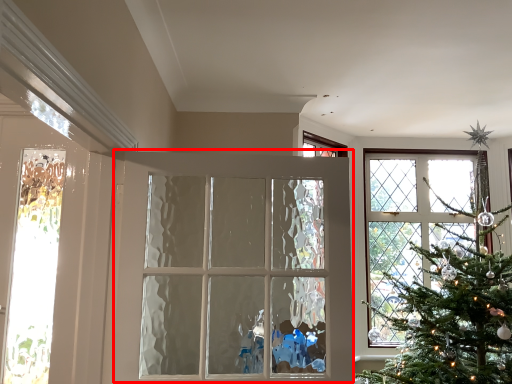
Question: From the image's perspective, what is the correct spatial relationship of door (annotated by the red box) in relation to door?

Choices:
 (A) above
 (B) below

Answer: (B)